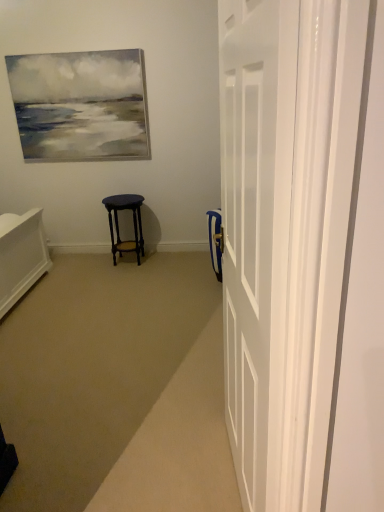
This screenshot has height=512, width=384. What do you see at coordinates (118, 224) in the screenshot?
I see `matte dark wood stool at center` at bounding box center [118, 224].

I want to click on matte dark wood stool at center, so click(118, 224).

What do you see at coordinates (247, 227) in the screenshot? I see `white glossy door at right` at bounding box center [247, 227].

This screenshot has height=512, width=384. I want to click on white glossy door at right, so click(247, 227).

The image size is (384, 512). I want to click on matte dark wood stool at center, so click(118, 224).

Looking at this image, considering the relative positions of white glossy door at right and matte dark wood stool at center in the image provided, is white glossy door at right to the left of matte dark wood stool at center from the viewer's perspective?

Incorrect, white glossy door at right is not on the left side of matte dark wood stool at center.

Is white glossy door at right further to the viewer compared to matte dark wood stool at center?

No, white glossy door at right is closer to the viewer.

Considering the positions of point (252, 95) and point (108, 199), is point (252, 95) closer or farther from the camera than point (108, 199)?

Point (252, 95) is closer to the camera than point (108, 199).

From the image's perspective, which is below, white glossy door at right or matte dark wood stool at center?

white glossy door at right, from the image's perspective.

From a real-world perspective, which is physically below, white glossy door at right or matte dark wood stool at center?

From a 3D spatial view, matte dark wood stool at center is below.

Which of these two, white glossy door at right or matte dark wood stool at center, is thinner?

Thinner between the two is white glossy door at right.

Considering the sizes of white glossy door at right and matte dark wood stool at center in the image, is white glossy door at right taller or shorter than matte dark wood stool at center?

white glossy door at right is taller than matte dark wood stool at center.

Does white glossy door at right have a larger size compared to matte dark wood stool at center?

Indeed, white glossy door at right has a larger size compared to matte dark wood stool at center.

Can we say white glossy door at right lies outside matte dark wood stool at center?

Indeed, white glossy door at right is completely outside matte dark wood stool at center.

Is white glossy door at right in contact with matte dark wood stool at center?

No, white glossy door at right is not touching matte dark wood stool at center.

Is white glossy door at right facing towards matte dark wood stool at center?

No, white glossy door at right is not aimed at matte dark wood stool at center.

Identify the location of door on the right of matte dark wood stool at center. The image size is (384, 512). [247, 227].

Considering the relative positions of matte dark wood stool at center and white glossy door at right in the image provided, is matte dark wood stool at center to the left or to the right of white glossy door at right?

Clearly, matte dark wood stool at center is on the left of white glossy door at right in the image.

Based on the photo, does matte dark wood stool at center come in front of white glossy door at right?

No, it is behind white glossy door at right.

Which is farther, [115,208] or [231,256]?

The point [115,208] is more distant.

From the image's perspective, which is above, matte dark wood stool at center or white glossy door at right?

From the image's view, matte dark wood stool at center is above.

From a real-world perspective, is matte dark wood stool at center located beneath white glossy door at right?

Indeed, from a real-world perspective, matte dark wood stool at center is positioned beneath white glossy door at right.

Is matte dark wood stool at center wider or thinner than white glossy door at right?

Clearly, matte dark wood stool at center has more width compared to white glossy door at right.

Is matte dark wood stool at center taller than white glossy door at right?

Incorrect, the height of matte dark wood stool at center is not larger of that of white glossy door at right.

Between matte dark wood stool at center and white glossy door at right, which one has smaller size?

matte dark wood stool at center.

Is white glossy door at right inside matte dark wood stool at center?

No, white glossy door at right is not surrounded by matte dark wood stool at center.

Is matte dark wood stool at center far from white glossy door at right?

matte dark wood stool at center is far away from white glossy door at right.

Could you tell me if matte dark wood stool at center is turned towards white glossy door at right?

No, matte dark wood stool at center is not oriented towards white glossy door at right.

How many degrees apart are the facing directions of matte dark wood stool at center and white glossy door at right?

They differ by 85.1 degrees in their facing directions.

How much distance is there between matte dark wood stool at center and white glossy door at right?

8.77 feet.

Locate an element on the screen. The image size is (384, 512). door that is on the right side of matte dark wood stool at center is located at coordinates (247, 227).

Identify the location of door below the matte dark wood stool at center (from the image's perspective). The width and height of the screenshot is (384, 512). (247, 227).

You are a GUI agent. You are given a task and a screenshot of the screen. Output one action in this format:
    pyautogui.click(x=<x>, y=<y>)
    Task: Click on the stool above the white glossy door at right (from the image's perspective)
    This screenshot has height=512, width=384.
    Given the screenshot: What is the action you would take?
    pyautogui.click(x=118, y=224)